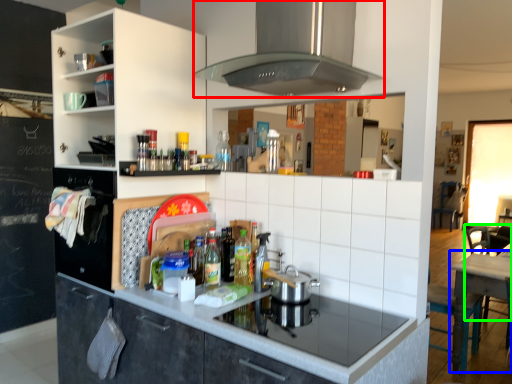
Question: Based on their relative distances, which object is nearer to home appliance (highlighted by a red box)? Choose from table (highlighted by a blue box) and chair (highlighted by a green box).

Choices:
 (A) table
 (B) chair

Answer: (A)